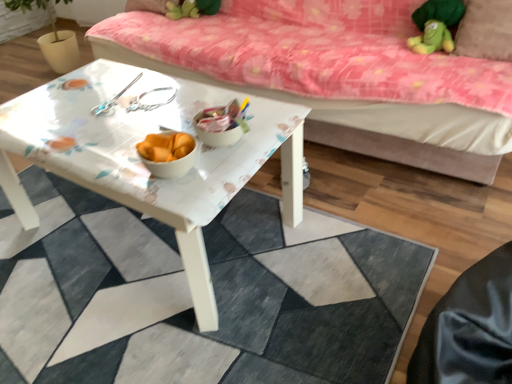
Question: Is white glossy table at center to the right of brown fabric pillow at upper right from the viewer's perspective?

Choices:
 (A) no
 (B) yes

Answer: (A)

Question: Does white glossy table at center have a larger size compared to brown fabric pillow at upper right?

Choices:
 (A) no
 (B) yes

Answer: (B)

Question: Is white glossy table at center far from brown fabric pillow at upper right?

Choices:
 (A) yes
 (B) no

Answer: (A)

Question: Is white glossy table at center completely or partially outside of brown fabric pillow at upper right?

Choices:
 (A) yes
 (B) no

Answer: (A)

Question: Are white glossy table at center and brown fabric pillow at upper right beside each other?

Choices:
 (A) no
 (B) yes

Answer: (A)

Question: Would you say white glossy table at center is inside or outside pink floral fabric studio couch at upper center?

Choices:
 (A) outside
 (B) inside

Answer: (A)

Question: Considering the positions of white glossy table at center and pink floral fabric studio couch at upper center in the image, is white glossy table at center taller or shorter than pink floral fabric studio couch at upper center?

Choices:
 (A) short
 (B) tall

Answer: (A)

Question: Considering their positions, is white glossy table at center located in front of or behind pink floral fabric studio couch at upper center?

Choices:
 (A) behind
 (B) front

Answer: (B)

Question: Is white glossy table at center to the left or to the right of pink floral fabric studio couch at upper center in the image?

Choices:
 (A) right
 (B) left

Answer: (B)

Question: Considering the positions of pink floral fabric studio couch at upper center and white glossy table at center in the image, is pink floral fabric studio couch at upper center bigger or smaller than white glossy table at center?

Choices:
 (A) big
 (B) small

Answer: (A)

Question: From a real-world perspective, is pink floral fabric studio couch at upper center physically located above or below white glossy table at center?

Choices:
 (A) below
 (B) above

Answer: (B)

Question: In terms of height, does pink floral fabric studio couch at upper center look taller or shorter compared to white glossy table at center?

Choices:
 (A) short
 (B) tall

Answer: (B)

Question: Choose the correct answer: Is pink floral fabric studio couch at upper center inside white glossy table at center or outside it?

Choices:
 (A) outside
 (B) inside

Answer: (A)

Question: From the image's perspective, relative to white glossy table at center, is brown fabric pillow at upper right above or below?

Choices:
 (A) above
 (B) below

Answer: (A)

Question: Is brown fabric pillow at upper right wider or thinner than white glossy table at center?

Choices:
 (A) thin
 (B) wide

Answer: (A)